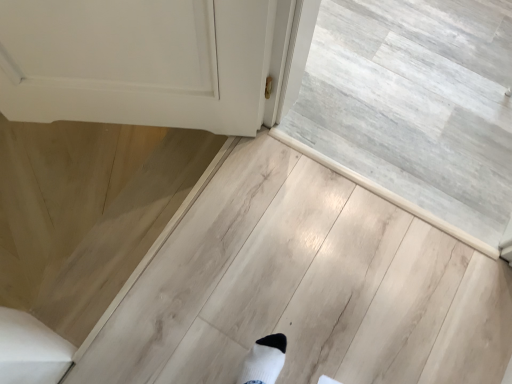
Identify the location of blank space situated above light wood stairwell at lower left (from a real-world perspective). (382, 117).